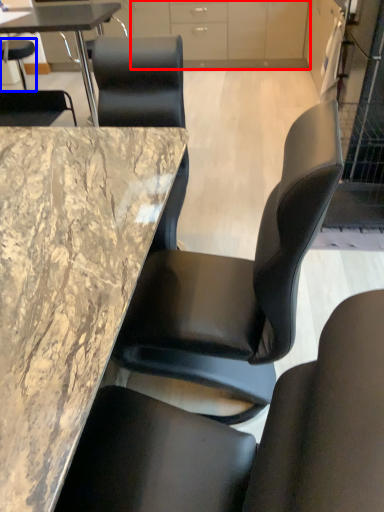
Question: Which object appears farthest to the camera in this image, cabinetry (highlighted by a red box) or chair (highlighted by a blue box)?

Choices:
 (A) cabinetry
 (B) chair

Answer: (B)